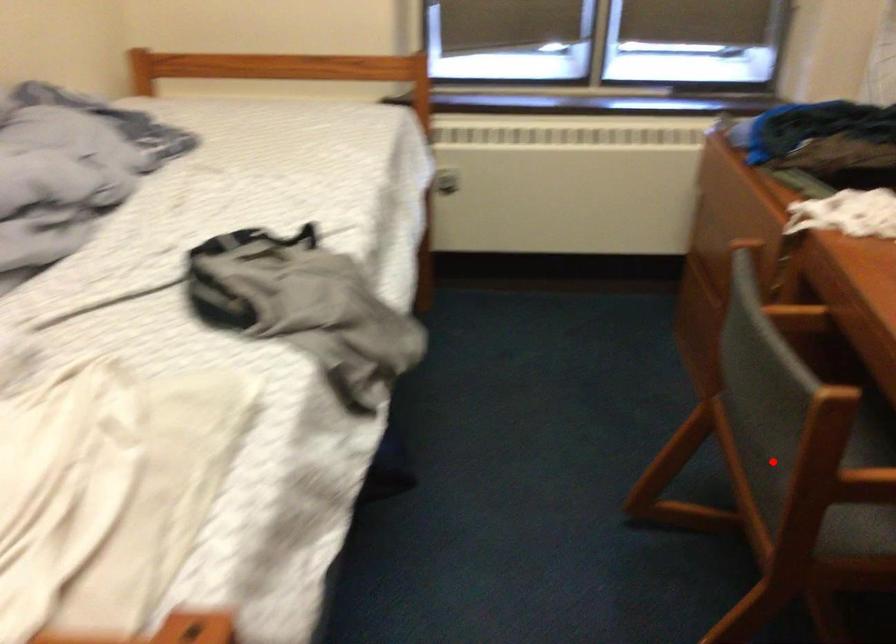
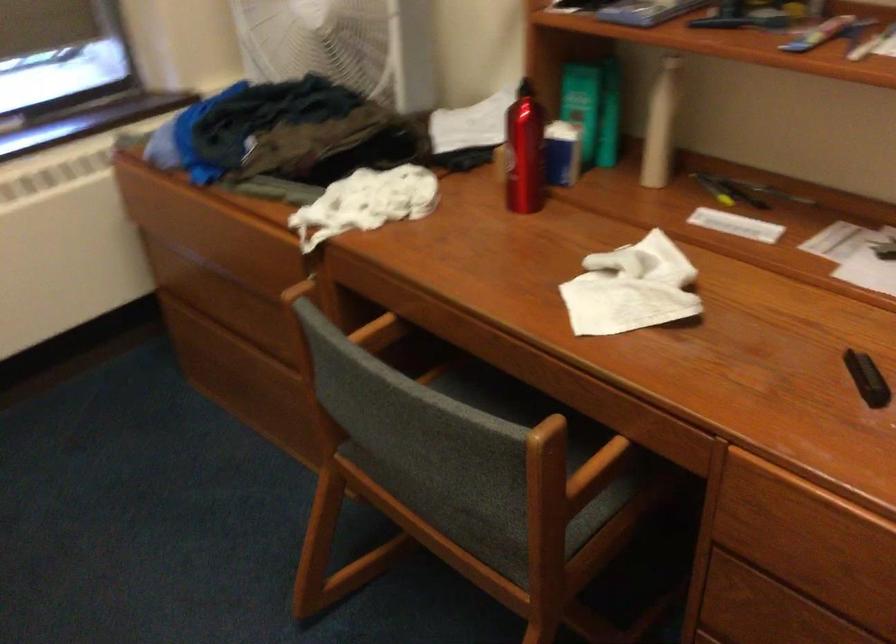
Question: I am providing you with two images of the same scene from different viewpoints. A red point is marked on the first image. Is the red point's position out of view in image 2?

Choices:
 (A) Yes
 (B) No

Answer: (B)